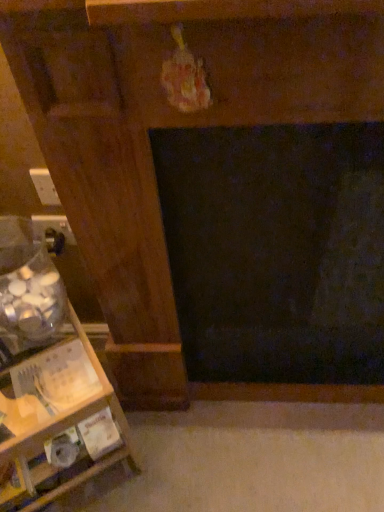
Question: Considering the relative sizes of white plastic electric outlet at left, placed as the first electric outlet when sorted from top to bottom, and matte black outlet at lower left, which ranks as the first electric outlet in bottom-to-top order, in the image provided, is white plastic electric outlet at left, placed as the first electric outlet when sorted from top to bottom, wider than matte black outlet at lower left, which ranks as the first electric outlet in bottom-to-top order,?

Choices:
 (A) yes
 (B) no

Answer: (B)

Question: Is white plastic electric outlet at left, which is the first electric outlet from front to back, turned away from matte black outlet at lower left, the 2th electric outlet viewed from the front?

Choices:
 (A) yes
 (B) no

Answer: (B)

Question: Considering the relative positions of white plastic electric outlet at left, which is the first electric outlet from front to back, and matte black outlet at lower left, the first electric outlet when ordered from back to front, in the image provided, is white plastic electric outlet at left, which is the first electric outlet from front to back, in front of matte black outlet at lower left, the first electric outlet when ordered from back to front,?

Choices:
 (A) yes
 (B) no

Answer: (A)

Question: Can you confirm if white plastic electric outlet at left, marked as the second electric outlet in a bottom-to-top arrangement, is thinner than matte black outlet at lower left, the 2th electric outlet viewed from the front?

Choices:
 (A) no
 (B) yes

Answer: (B)

Question: Is white plastic electric outlet at left, marked as the second electric outlet in a bottom-to-top arrangement, shorter than matte black outlet at lower left, which ranks as the first electric outlet in bottom-to-top order?

Choices:
 (A) no
 (B) yes

Answer: (A)

Question: Does white plastic electric outlet at left, which is the second electric outlet in back-to-front order, turn towards matte black outlet at lower left, which is counted as the second electric outlet, starting from the top?

Choices:
 (A) no
 (B) yes

Answer: (A)

Question: Is wooden shelf at left bigger than matte black outlet at lower left, the first electric outlet when ordered from back to front?

Choices:
 (A) no
 (B) yes

Answer: (B)

Question: From a real-world perspective, is wooden shelf at left physically above matte black outlet at lower left, the 2th electric outlet viewed from the front?

Choices:
 (A) yes
 (B) no

Answer: (B)

Question: Is wooden shelf at left to the left of matte black outlet at lower left, which ranks as the first electric outlet in bottom-to-top order, from the viewer's perspective?

Choices:
 (A) no
 (B) yes

Answer: (B)

Question: Is wooden shelf at left closer to the viewer compared to matte black outlet at lower left, which is counted as the second electric outlet, starting from the top?

Choices:
 (A) yes
 (B) no

Answer: (A)

Question: Is wooden shelf at left thinner than matte black outlet at lower left, which is counted as the second electric outlet, starting from the top?

Choices:
 (A) no
 (B) yes

Answer: (A)

Question: Is wooden shelf at left in contact with matte black outlet at lower left, which ranks as the first electric outlet in bottom-to-top order?

Choices:
 (A) yes
 (B) no

Answer: (B)

Question: From a real-world perspective, does white plastic electric outlet at left, marked as the second electric outlet in a bottom-to-top arrangement, sit lower than wooden shelf at left?

Choices:
 (A) no
 (B) yes

Answer: (A)